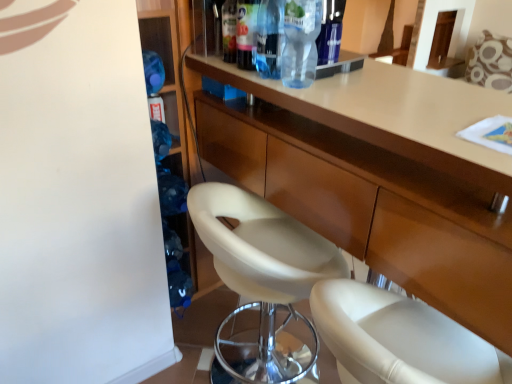
Question: Is translucent plastic bottle at upper center, the fourth bottle in the right-to-left sequence, further to the viewer compared to matte wood cabinet at center?

Choices:
 (A) no
 (B) yes

Answer: (B)

Question: From the image's perspective, is translucent plastic bottle at upper center, the fourth bottle in the right-to-left sequence, located above matte wood cabinet at center?

Choices:
 (A) yes
 (B) no

Answer: (A)

Question: Does translucent plastic bottle at upper center, the fourth bottle in the right-to-left sequence, have a greater height compared to matte wood cabinet at center?

Choices:
 (A) no
 (B) yes

Answer: (A)

Question: Considering the relative sizes of translucent plastic bottle at upper center, the fourth bottle in the right-to-left sequence, and matte wood cabinet at center in the image provided, is translucent plastic bottle at upper center, the fourth bottle in the right-to-left sequence, smaller than matte wood cabinet at center?

Choices:
 (A) no
 (B) yes

Answer: (B)

Question: Considering the relative sizes of translucent plastic bottle at upper center, which ranks as the 1th bottle in left-to-right order, and matte wood cabinet at center in the image provided, is translucent plastic bottle at upper center, which ranks as the 1th bottle in left-to-right order, shorter than matte wood cabinet at center?

Choices:
 (A) no
 (B) yes

Answer: (B)

Question: Is matte wood cabinet at center located within translucent plastic bottle at upper center, the fourth bottle in the right-to-left sequence?

Choices:
 (A) no
 (B) yes

Answer: (A)

Question: Can you confirm if transparent plastic bottle at upper center, the 4th bottle from the left, is smaller than transparent plastic bottle at upper center, which ranks as the 2th bottle in left-to-right order?

Choices:
 (A) yes
 (B) no

Answer: (B)

Question: From the image's perspective, is transparent plastic bottle at upper center, the 4th bottle from the left, over transparent plastic bottle at upper center, which ranks as the 2th bottle in left-to-right order?

Choices:
 (A) yes
 (B) no

Answer: (B)

Question: Can you confirm if transparent plastic bottle at upper center, the 4th bottle from the left, is positioned to the left of transparent plastic bottle at upper center, which ranks as the 2th bottle in left-to-right order?

Choices:
 (A) no
 (B) yes

Answer: (A)

Question: From a real-world perspective, is transparent plastic bottle at upper center, the 4th bottle from the left, over transparent plastic bottle at upper center, which ranks as the 2th bottle in left-to-right order?

Choices:
 (A) yes
 (B) no

Answer: (B)

Question: Is transparent plastic bottle at upper center, the 4th bottle from the left, oriented away from transparent plastic bottle at upper center, which is counted as the third bottle, starting from the right?

Choices:
 (A) yes
 (B) no

Answer: (A)

Question: Is the depth of transparent plastic bottle at upper center, the first bottle in the right-to-left sequence, less than that of transparent plastic bottle at upper center, which is counted as the third bottle, starting from the right?

Choices:
 (A) yes
 (B) no

Answer: (A)

Question: From the image's perspective, is transparent plastic bottle at upper center, which is counted as the third bottle, starting from the right, under transparent plastic bottle at upper center, the 4th bottle from the left?

Choices:
 (A) no
 (B) yes

Answer: (A)